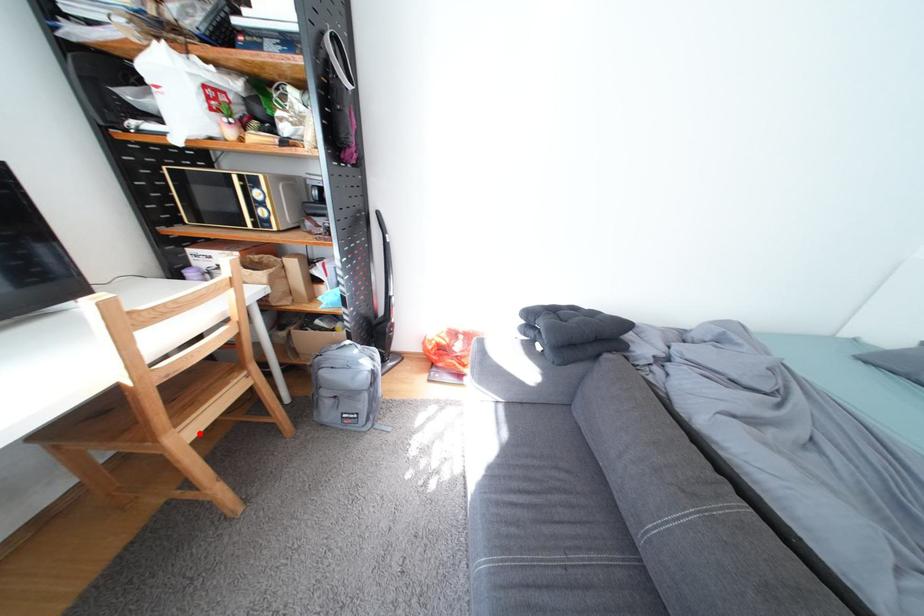
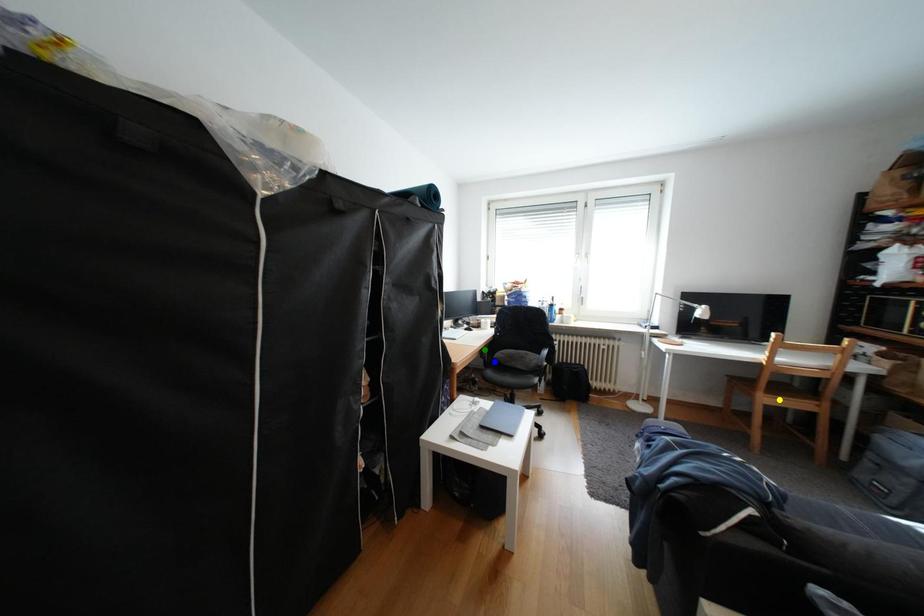
Question: I am providing you with two images of the same scene from different viewpoints. A red point is marked on the first image. You are given multiple points on the second image. Which point in image 2 is actually the same real-world point as the red point in image 1?

Choices:
 (A) green point
 (B) yellow point
 (C) blue point

Answer: (B)